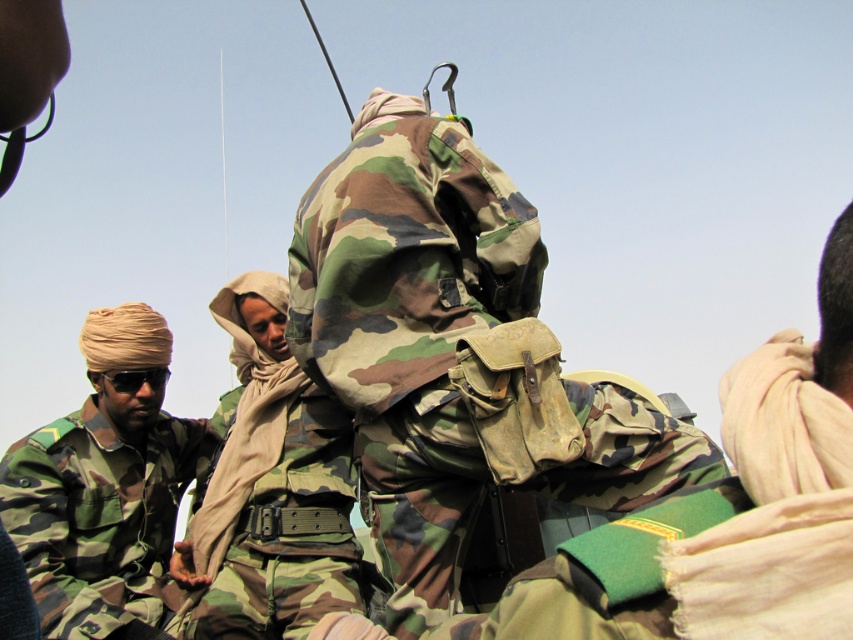
Who is positioned more to the left, camouflage fabric backpack at center or camouflage fabric uniform at left?

From the viewer's perspective, camouflage fabric uniform at left appears more on the left side.

Can you confirm if camouflage fabric backpack at center is positioned above camouflage fabric uniform at left?

Correct, camouflage fabric backpack at center is located above camouflage fabric uniform at left.

Between point (399, 566) and point (32, 545), which one is positioned behind?

Point (32, 545)

Where is `camouflage fabric backpack at center`? camouflage fabric backpack at center is located at coordinates (410, 326).

Can you confirm if camouflage fabric uniform at left is thinner than camo fabric uniform at center?

No.

Who is shorter, camouflage fabric uniform at left or camo fabric uniform at center?

camouflage fabric uniform at left

Does point (82, 493) come closer to viewer compared to point (322, 481)?

No, (82, 493) is further to viewer.

What are the coordinates of `camouflage fabric uniform at left` in the screenshot? It's located at (105, 484).

Image resolution: width=853 pixels, height=640 pixels. Describe the element at coordinates (410, 326) in the screenshot. I see `camouflage fabric backpack at center` at that location.

Between point (656, 422) and point (306, 497), which one is positioned behind?

The point (306, 497) is more distant.

Locate an element on the screen. Image resolution: width=853 pixels, height=640 pixels. camouflage fabric backpack at center is located at coordinates (410, 326).